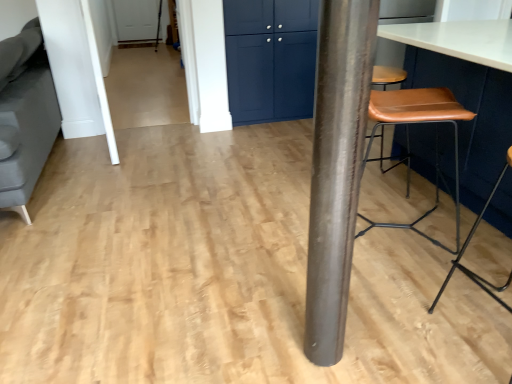
Find the location of `free point behind brown leather stool at right`. free point behind brown leather stool at right is located at coordinates (457, 266).